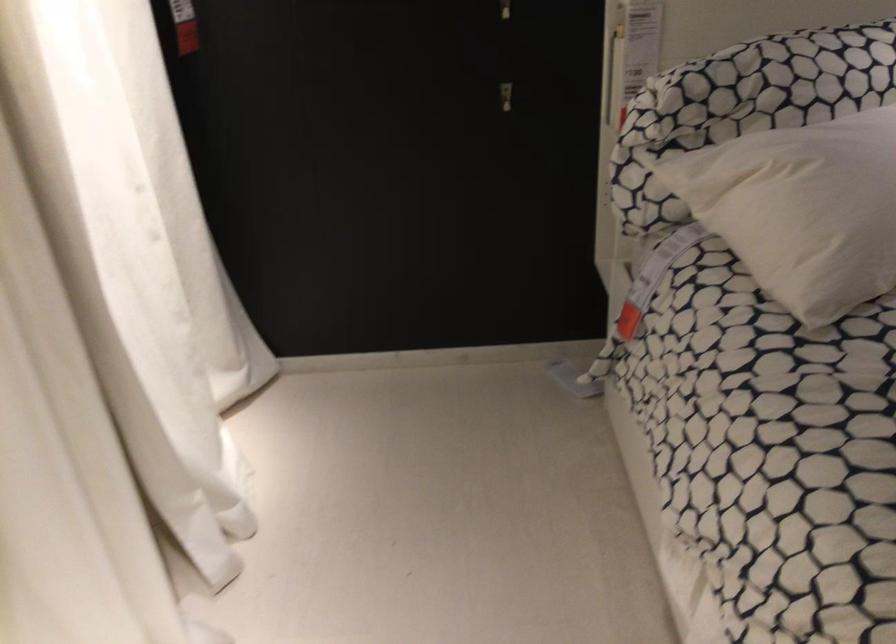
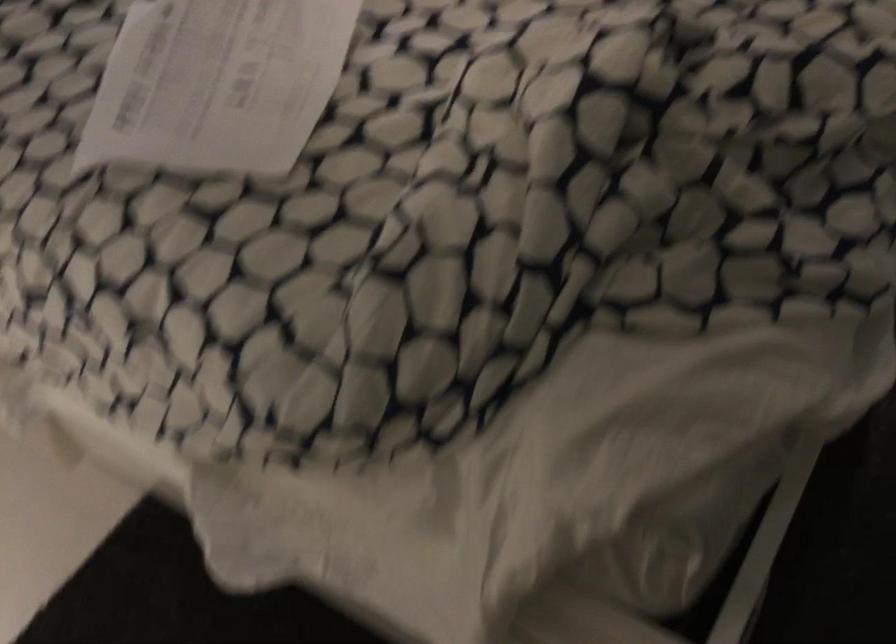
The first image is from the beginning of the video and the second image is from the end. How did the camera likely rotate when shooting the video?

The camera rotated toward right-down.